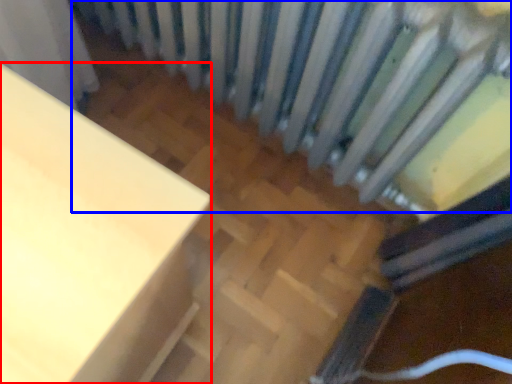
Question: Which point is further to the camera, furniture (highlighted by a red box) or radiator (highlighted by a blue box)?

Choices:
 (A) furniture
 (B) radiator

Answer: (B)